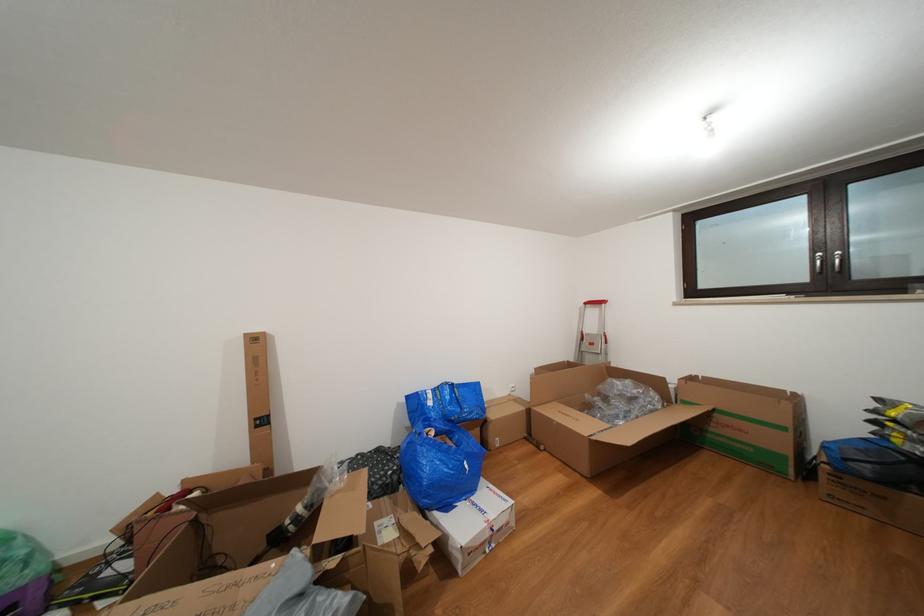
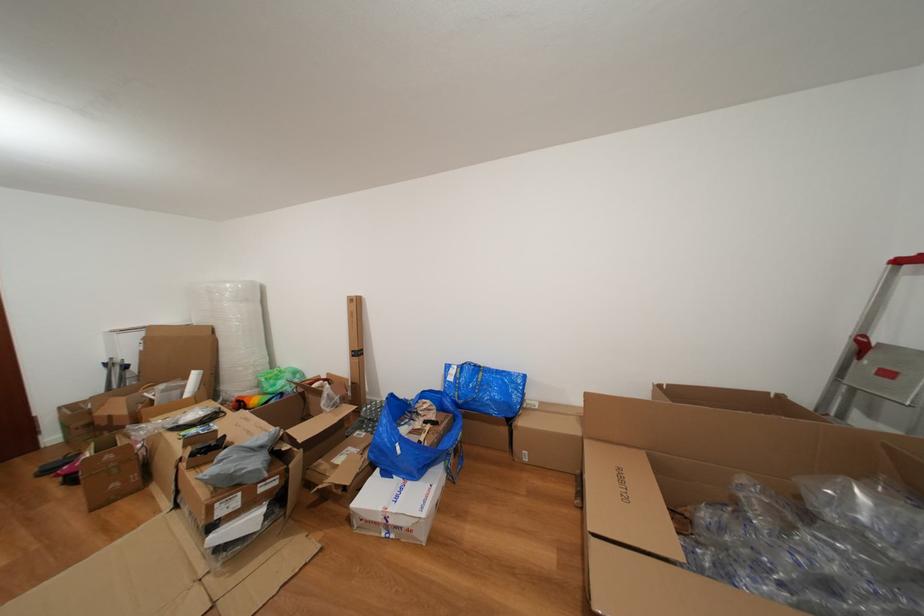
The point at (x=456, y=513) is marked in the first image. Where is the corresponding point in the second image?

(394, 479)